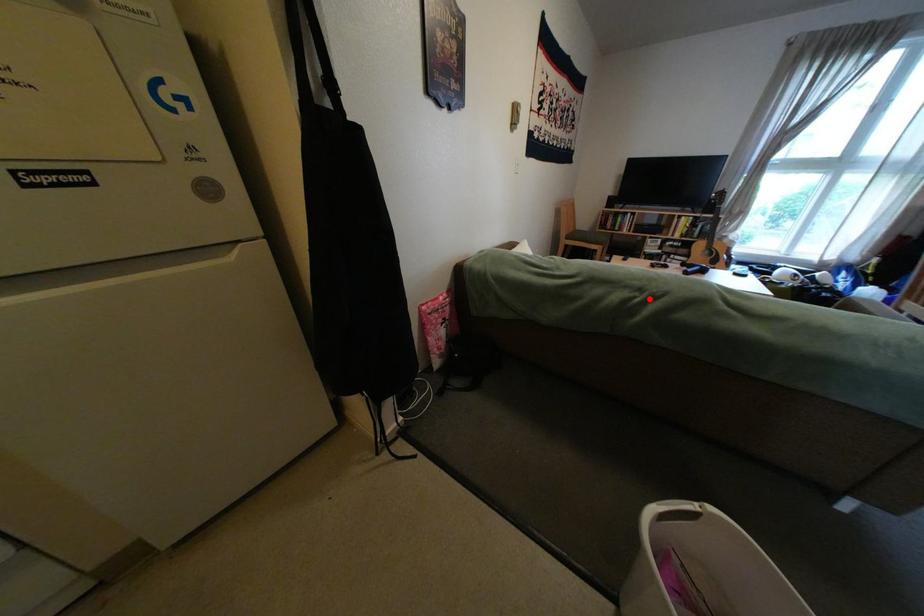
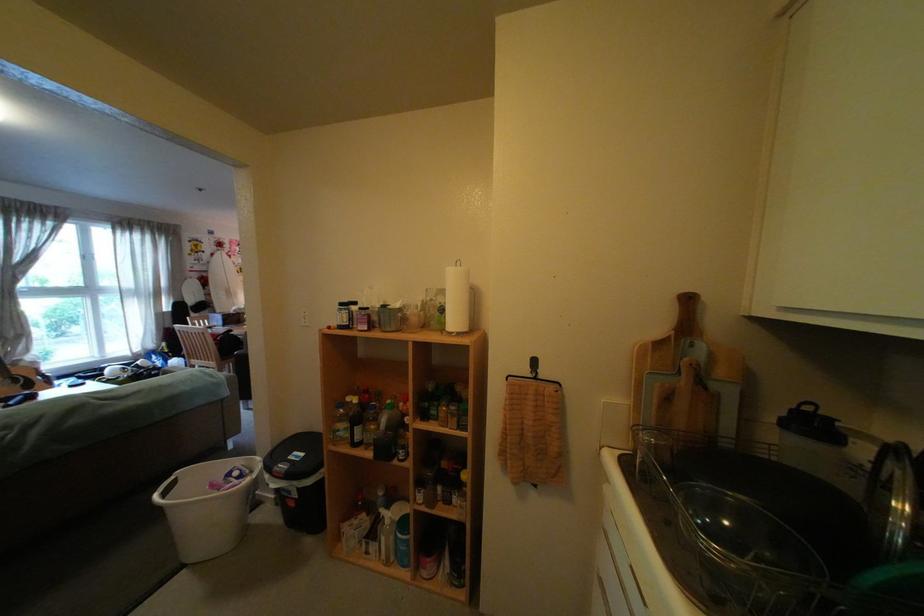
In the second image, find the point that corresponds to the highlighted location in the first image.

(20, 437)